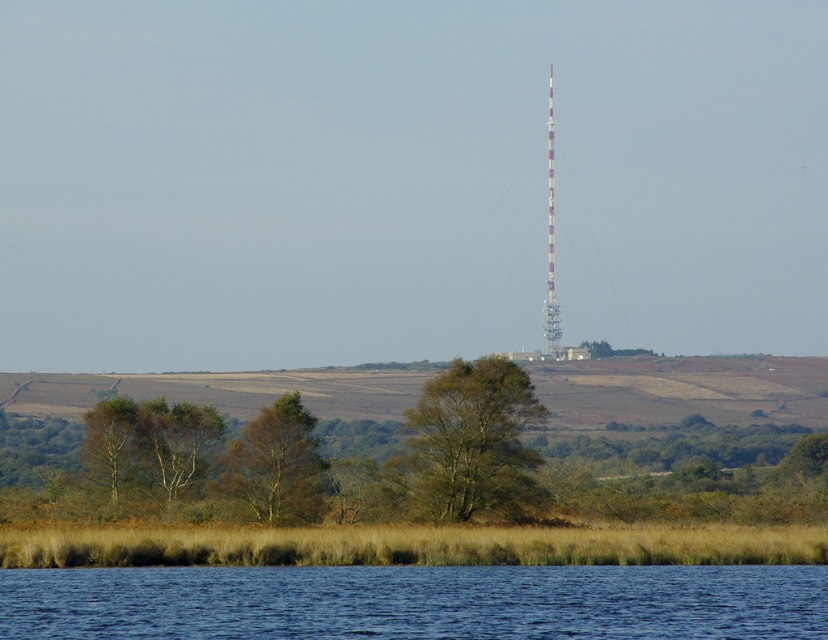
Does point (262, 451) come closer to viewer compared to point (186, 408)?

Yes, it is.

Is point (258, 474) positioned after point (177, 445)?

No, (258, 474) is in front of (177, 445).

The width and height of the screenshot is (828, 640). Find the location of `brown textured tree at lower center`. brown textured tree at lower center is located at coordinates (277, 464).

Does point (485, 392) come closer to viewer compared to point (118, 484)?

Yes.

Does green rough bark tree at center have a lesser width compared to green leafy tree at lower left?

Yes, green rough bark tree at center is thinner than green leafy tree at lower left.

Who is more distant from viewer, [538,492] or [109,410]?

The point [109,410] is behind.

What are the coordinates of `green rough bark tree at center` in the screenshot? It's located at (470, 442).

Between blue liquid water at lower center and brown textured tree at lower center, which one is positioned lower?

blue liquid water at lower center is lower down.

Identify the location of blue liquid water at lower center. This screenshot has width=828, height=640. (415, 602).

What do you see at coordinates (415, 602) in the screenshot? The height and width of the screenshot is (640, 828). I see `blue liquid water at lower center` at bounding box center [415, 602].

Image resolution: width=828 pixels, height=640 pixels. In order to click on blue liquid water at lower center in this screenshot , I will do `click(415, 602)`.